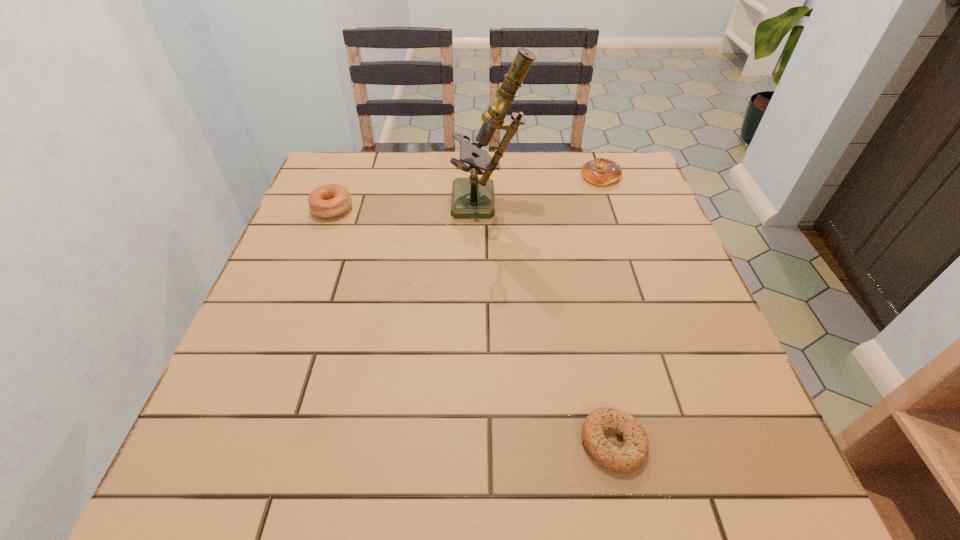
The height and width of the screenshot is (540, 960). What are the coordinates of `free space at the far edge of the desktop` in the screenshot? It's located at (x=388, y=177).

At what (x,y) coordinates should I click in order to perform the action: click on vacant space at the near edge. Please return your answer as a coordinate pair (x, y). Looking at the image, I should click on (431, 475).

The width and height of the screenshot is (960, 540). In order to click on blank space at the left edge in this screenshot , I will do `click(256, 405)`.

You are a GUI agent. You are given a task and a screenshot of the screen. Output one action in this format:
    pyautogui.click(x=<x>, y=<y>)
    Task: Click on the free space at the right edge of the desktop
    The image size is (960, 540).
    Given the screenshot: What is the action you would take?
    pyautogui.click(x=617, y=245)

Locate an element on the screen. free space at the far right corner of the desktop is located at coordinates (604, 193).

This screenshot has width=960, height=540. In order to click on free spot between the tallest object and the nearest bagel in this screenshot , I will do `click(551, 323)`.

I want to click on vacant area between the rightmost bagel and the third object from right to left, so click(544, 190).

Where is `free space between the microscope and the rightmost object`? This screenshot has height=540, width=960. free space between the microscope and the rightmost object is located at coordinates (544, 190).

Image resolution: width=960 pixels, height=540 pixels. Find the location of `free space between the second bagel from right to left and the rightmost object`. free space between the second bagel from right to left and the rightmost object is located at coordinates (607, 308).

This screenshot has height=540, width=960. I want to click on free area in between the third object from right to left and the nearest object, so click(551, 323).